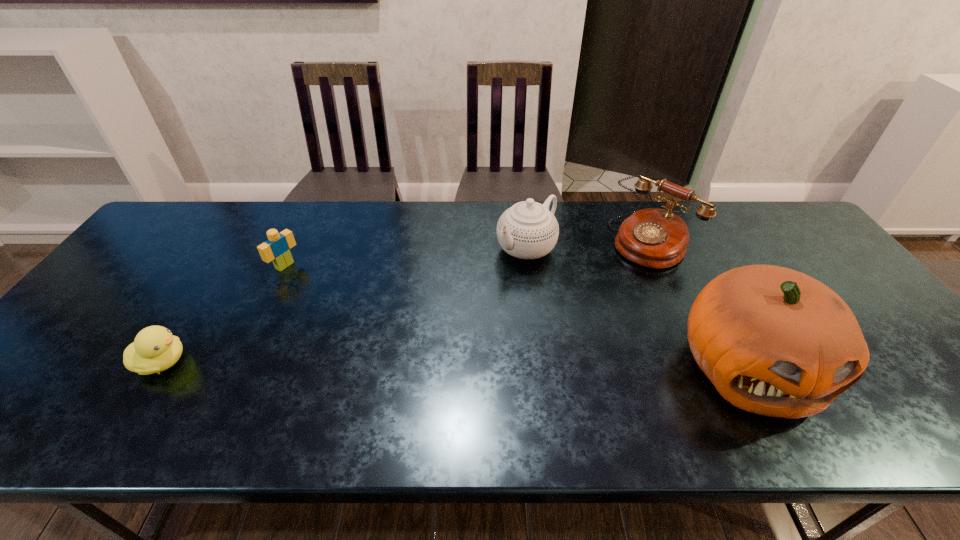
At what (x,y) coordinates should I click in order to perform the action: click on free point between the leftmost object and the Lego. Please return your answer as a coordinate pair (x, y). This screenshot has width=960, height=540. Looking at the image, I should click on (224, 314).

You are a GUI agent. You are given a task and a screenshot of the screen. Output one action in this format:
    pyautogui.click(x=<x>, y=<y>)
    Task: Click on the unoccupied area between the Lego and the third object from left to right
    The height and width of the screenshot is (540, 960).
    Given the screenshot: What is the action you would take?
    pyautogui.click(x=405, y=257)

Locate an element on the screen. free space between the third object from right to left and the telephone is located at coordinates tap(589, 244).

Point out which object is positioned as the fourth nearest to the tallest object. Please provide its 2D coordinates. Your answer should be formatted as a tuple, i.e. [(x, y)], where the tuple contains the x and y coordinates of a point satisfying the conditions above.

[(155, 349)]

Identify which object is located as the second nearest to the fourth object from right to left. Please provide its 2D coordinates. Your answer should be formatted as a tuple, i.e. [(x, y)], where the tuple contains the x and y coordinates of a point satisfying the conditions above.

[(528, 230)]